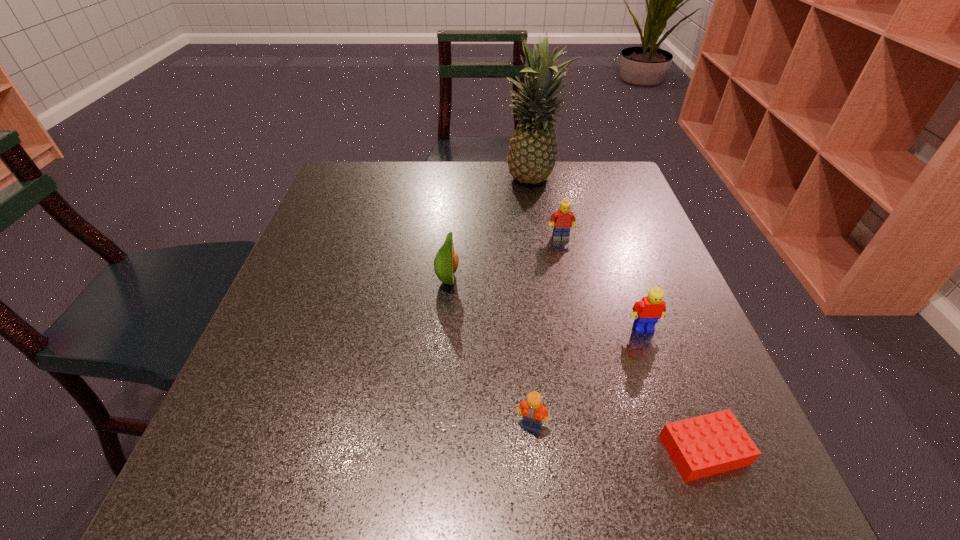
Find the location of `vacant space that satisfies the following two spatial constraints: 1. on the front-facing side of the shortest Lego; 2. on the right side of the third nearest object`. vacant space that satisfies the following two spatial constraints: 1. on the front-facing side of the shortest Lego; 2. on the right side of the third nearest object is located at coordinates (686, 450).